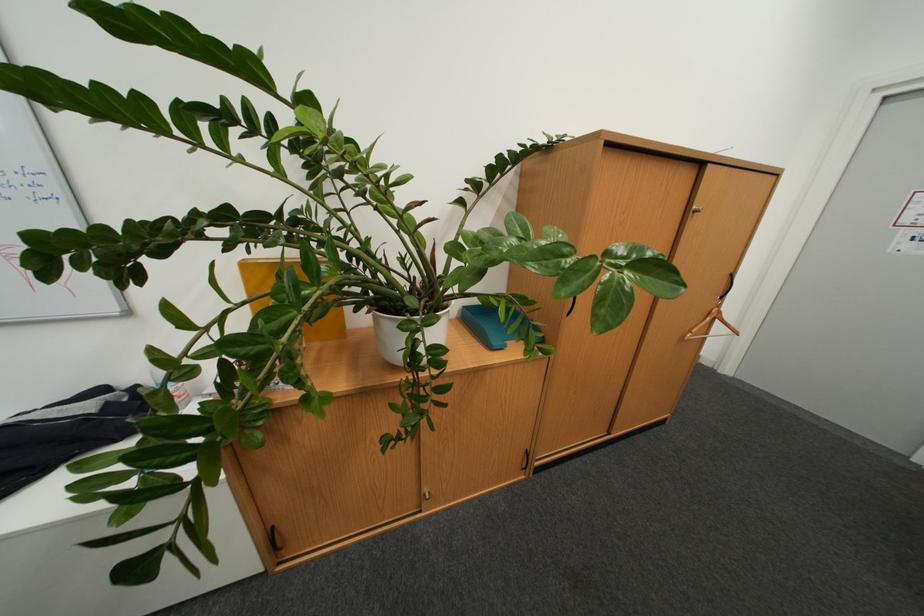
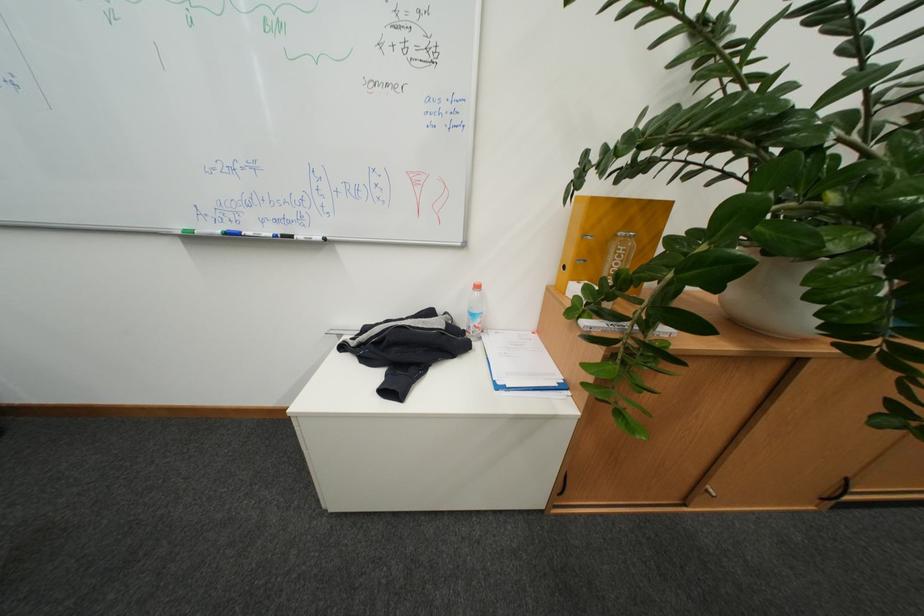
Question: The first image is from the beginning of the video and the second image is from the end. How did the camera likely rotate when shooting the video?

Choices:
 (A) Left
 (B) Right
 (C) Up
 (D) Down

Answer: (A)